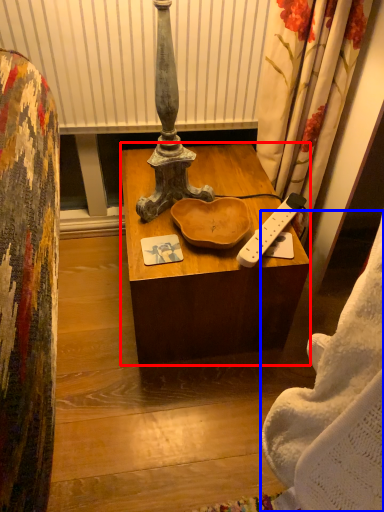
Question: Which point is further to the camera, desk (highlighted by a red box) or blanket (highlighted by a blue box)?

Choices:
 (A) desk
 (B) blanket

Answer: (A)